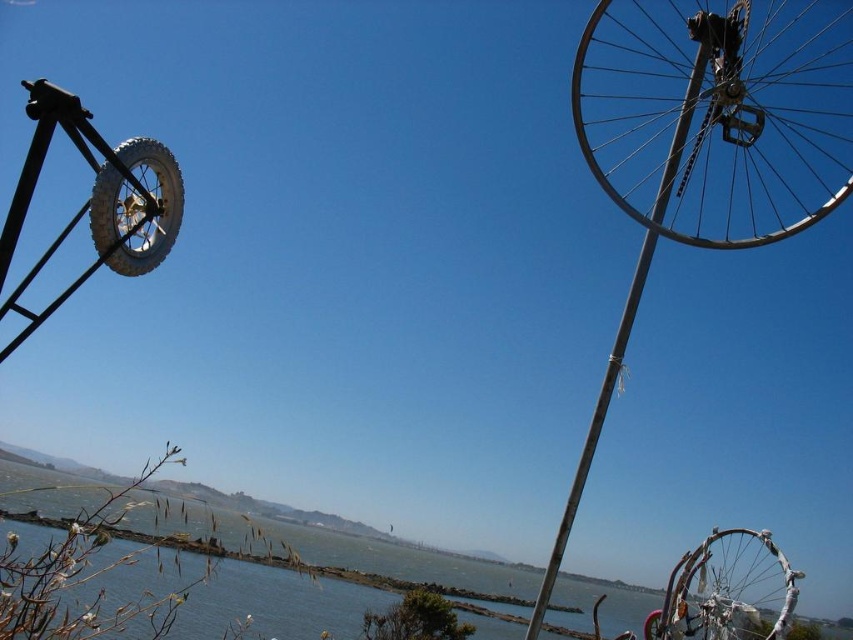
Question: Estimate the real-world distances between objects in this image. Which object is closer to the metallic pole at upper right?

Choices:
 (A) silver metallic bicycle wheel at lower right
 (B) rubber/textured tire at right
 (C) metallic silver bicycle wheel at upper right

Answer: (A)

Question: Estimate the real-world distances between objects in this image. Which object is farther from the metallic pole at upper right?

Choices:
 (A) rubber/textured tire at right
 (B) clear blue water at lower center

Answer: (B)

Question: Is rubber/textured tire at left wider than rubber/textured tire at right?

Choices:
 (A) yes
 (B) no

Answer: (B)

Question: Which object is closer to the camera taking this photo?

Choices:
 (A) clear blue water at lower center
 (B) silver metallic bicycle wheel at lower right
 (C) metallic pole at upper right
 (D) metallic silver bicycle wheel at upper right

Answer: (A)

Question: Does silver metallic bicycle wheel at lower right appear on the left side of rubber/textured tire at right?

Choices:
 (A) no
 (B) yes

Answer: (A)

Question: Is clear blue water at lower center to the right of rubber/textured tire at right from the viewer's perspective?

Choices:
 (A) yes
 (B) no

Answer: (B)